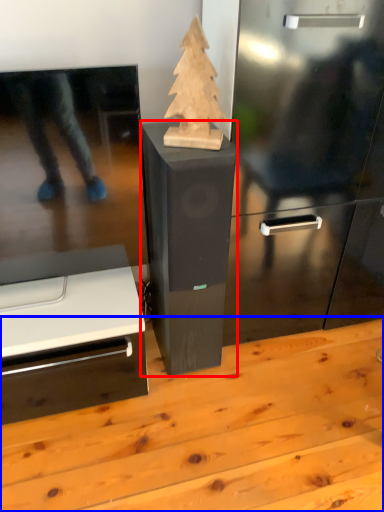
Question: Among these objects, which one is nearest to the camera, furniture (highlighted by a red box) or table (highlighted by a blue box)?

Choices:
 (A) furniture
 (B) table

Answer: (B)